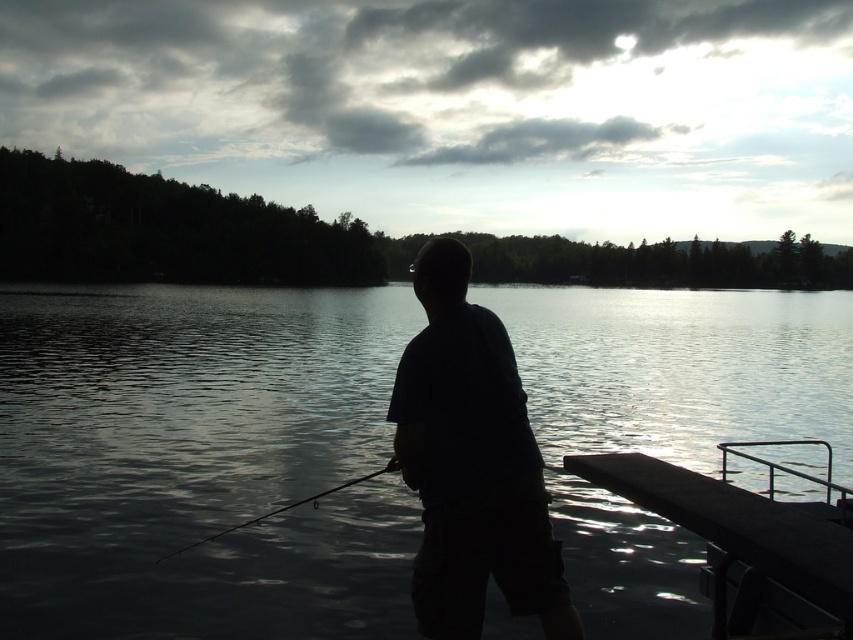
You are planning to take a photo of the fishing scene. The camera can only capture objects within a 1.5 meter width. Given that the transparent water at center and dark blue shirt at center are both in the center, will both fit within the camera frame?

The transparent water at center is wider than the dark blue shirt at center. Since the camera can capture up to 1.5 meters, and the water is wider, it depends on the actual width of the water. However, since the shirt is narrower than the water, if the water fits, the shirt will also fit. But without exact measurements, we can only confirm that the shirt will definitely fit if the water does.

You are a photographer trying to capture the reflection of the fishing pole in the water. Based on the scene, can you determine if the silvery metallic fishing pole at lower center is positioned to the left or right of the transparent water at center?

The transparent water at center is positioned on the right side of silvery metallic fishing pole at lower center, so the fishing pole is to the left of the water. Therefore, the reflection of the silvery metallic fishing pole at lower center would appear on the left side of the transparent water at center.